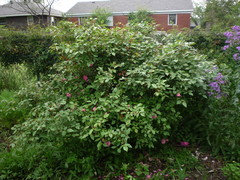
Find the location of a particular element. This screenshot has width=240, height=180. door is located at coordinates (83, 19).